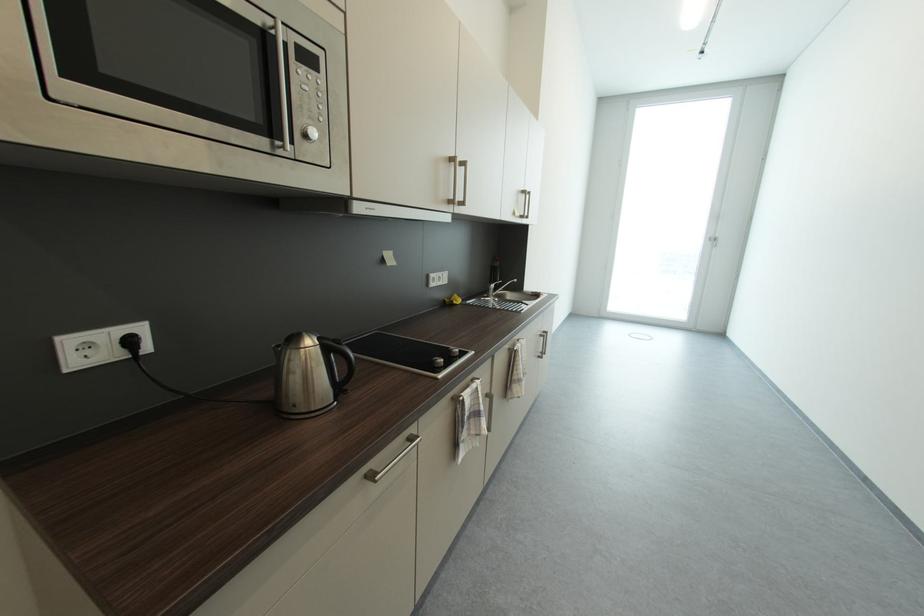
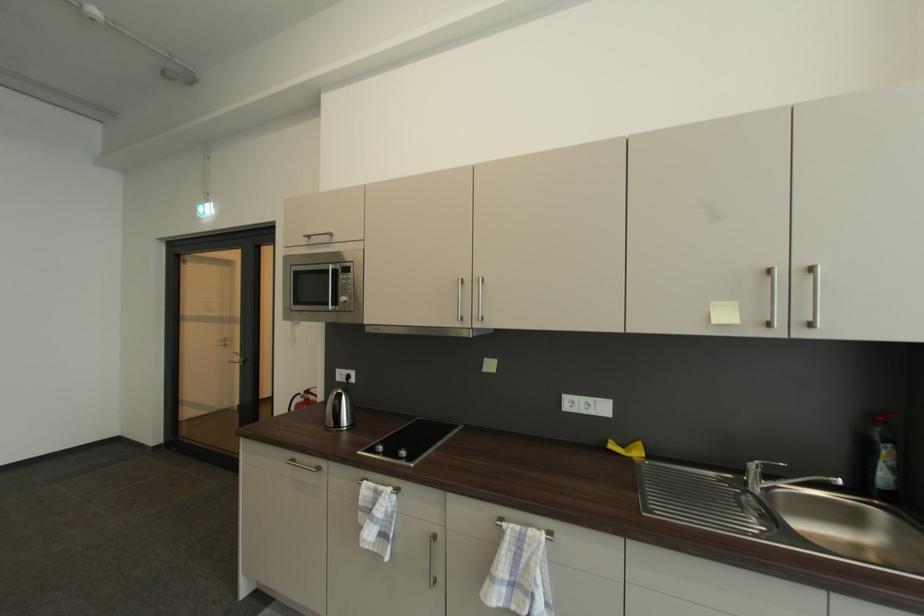
The point at (505, 260) is marked in the first image. Where is the corresponding point in the second image?

(885, 419)